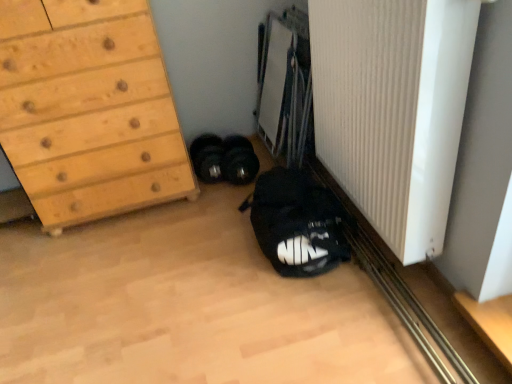
Question: Can you confirm if white ribbed radiator at lower right is bigger than wooden chest of drawers at left?

Choices:
 (A) no
 (B) yes

Answer: (A)

Question: Does white ribbed radiator at lower right have a greater width compared to wooden chest of drawers at left?

Choices:
 (A) yes
 (B) no

Answer: (B)

Question: From the image's perspective, is white ribbed radiator at lower right beneath wooden chest of drawers at left?

Choices:
 (A) yes
 (B) no

Answer: (A)

Question: Is white ribbed radiator at lower right positioned before wooden chest of drawers at left?

Choices:
 (A) no
 (B) yes

Answer: (B)

Question: Is white ribbed radiator at lower right not inside wooden chest of drawers at left?

Choices:
 (A) yes
 (B) no

Answer: (A)

Question: Is white ribbed radiator at lower right to the left of wooden chest of drawers at left from the viewer's perspective?

Choices:
 (A) no
 (B) yes

Answer: (A)

Question: Does black rubber dumbbells at center, acting as the 1th footwear starting from the right, have a greater height compared to black matte sneakers at lower left, which appears as the first footwear when viewed from the left?

Choices:
 (A) no
 (B) yes

Answer: (B)

Question: Can you confirm if black rubber dumbbells at center, acting as the 1th footwear starting from the right, is positioned to the right of black matte sneakers at lower left, placed as the second footwear when sorted from right to left?

Choices:
 (A) no
 (B) yes

Answer: (B)

Question: From a real-world perspective, does black rubber dumbbells at center, acting as the 1th footwear starting from the right, sit lower than black matte sneakers at lower left, which appears as the first footwear when viewed from the left?

Choices:
 (A) yes
 (B) no

Answer: (B)

Question: Is black rubber dumbbells at center, marked as the second footwear in a left-to-right arrangement, shorter than black matte sneakers at lower left, placed as the second footwear when sorted from right to left?

Choices:
 (A) no
 (B) yes

Answer: (A)

Question: Is black rubber dumbbells at center, marked as the second footwear in a left-to-right arrangement, bigger than black matte sneakers at lower left, placed as the second footwear when sorted from right to left?

Choices:
 (A) no
 (B) yes

Answer: (B)

Question: Does black rubber dumbbells at center, acting as the 1th footwear starting from the right, come behind black matte sneakers at lower left, placed as the second footwear when sorted from right to left?

Choices:
 (A) yes
 (B) no

Answer: (B)

Question: Is black rubber dumbbells at center, marked as the second footwear in a left-to-right arrangement, with white ribbed radiator at lower right?

Choices:
 (A) no
 (B) yes

Answer: (A)